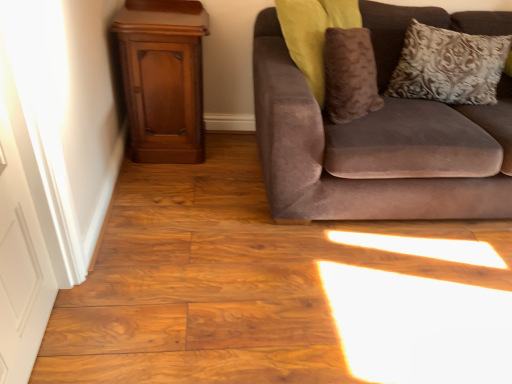
Identify the location of vacant area that lies between mahogany wood dresser at left and white painted wood door at left. (133, 231).